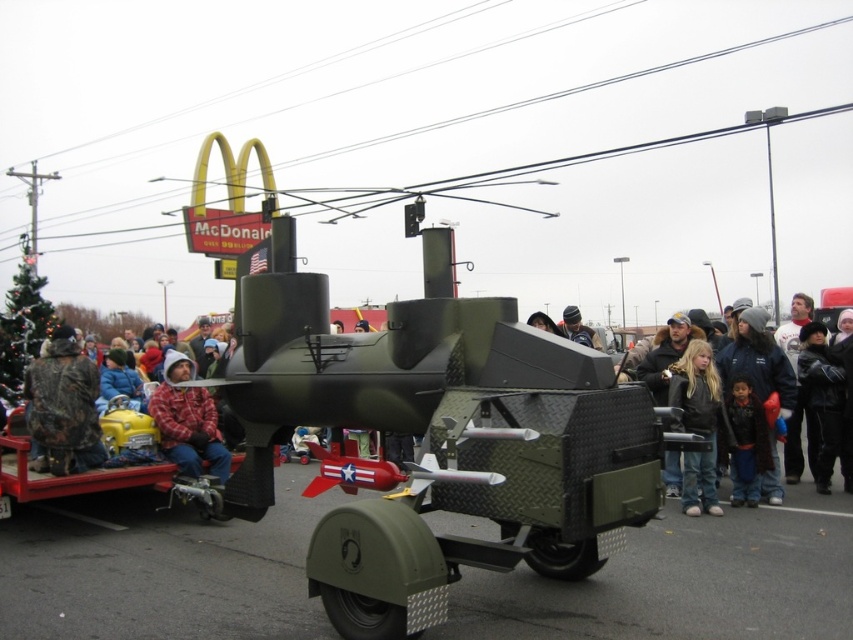
You are a photographer at the parade. You want to take a photo of the dark green military vehicle at center and the person with blonde hair at center. Based on their positions, which object should be on the right side of the photo?

The dark green military vehicle at center should be on the right side of the photo because the blonde hair at center is to the left of it.